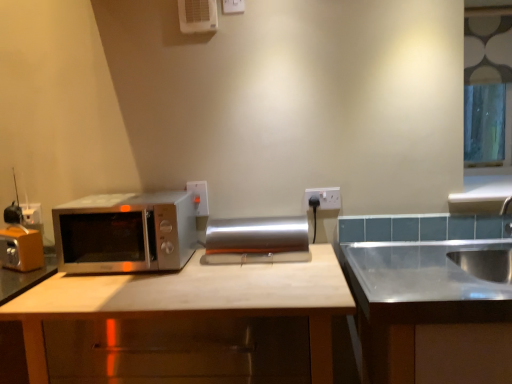
Question: Can you confirm if white plastic air conditioner at upper center is positioned to the right of matte wood cabinet at center, marked as the 1th cabinetry in a left-to-right arrangement?

Choices:
 (A) yes
 (B) no

Answer: (B)

Question: From the image's perspective, would you say white plastic air conditioner at upper center is shown under matte wood cabinet at center, which appears as the second cabinetry when viewed from the right?

Choices:
 (A) no
 (B) yes

Answer: (A)

Question: Considering the relative sizes of white plastic air conditioner at upper center and matte wood cabinet at center, which appears as the second cabinetry when viewed from the right, in the image provided, is white plastic air conditioner at upper center taller than matte wood cabinet at center, which appears as the second cabinetry when viewed from the right,?

Choices:
 (A) no
 (B) yes

Answer: (A)

Question: Can you confirm if white plastic air conditioner at upper center is bigger than matte wood cabinet at center, marked as the 1th cabinetry in a left-to-right arrangement?

Choices:
 (A) yes
 (B) no

Answer: (B)

Question: Is white plastic air conditioner at upper center to the left of matte wood cabinet at center, which appears as the second cabinetry when viewed from the right, from the viewer's perspective?

Choices:
 (A) no
 (B) yes

Answer: (B)

Question: Visually, is matte wood cabinet at center, marked as the 1th cabinetry in a left-to-right arrangement, positioned to the left or to the right of silver metallic paper towel holder at center?

Choices:
 (A) left
 (B) right

Answer: (A)

Question: Does point (31, 379) appear closer or farther from the camera than point (269, 246)?

Choices:
 (A) farther
 (B) closer

Answer: (B)

Question: From the image's perspective, is matte wood cabinet at center, marked as the 1th cabinetry in a left-to-right arrangement, positioned above or below silver metallic paper towel holder at center?

Choices:
 (A) above
 (B) below

Answer: (B)

Question: In terms of width, does matte wood cabinet at center, marked as the 1th cabinetry in a left-to-right arrangement, look wider or thinner when compared to silver metallic paper towel holder at center?

Choices:
 (A) wide
 (B) thin

Answer: (A)

Question: Is satin silver microwave at left wider or thinner than white plastic electric outlet at upper right?

Choices:
 (A) thin
 (B) wide

Answer: (B)

Question: From the image's perspective, is satin silver microwave at left located above or below white plastic electric outlet at upper right?

Choices:
 (A) above
 (B) below

Answer: (B)

Question: In terms of size, does satin silver microwave at left appear bigger or smaller than white plastic electric outlet at upper right?

Choices:
 (A) big
 (B) small

Answer: (A)

Question: From a real-world perspective, is satin silver microwave at left above or below white plastic electric outlet at upper right?

Choices:
 (A) above
 (B) below

Answer: (B)

Question: From a real-world perspective, is clear glass window at upper right positioned above or below satin silver microwave at left?

Choices:
 (A) above
 (B) below

Answer: (A)

Question: Is point (477, 52) closer or farther from the camera than point (166, 240)?

Choices:
 (A) farther
 (B) closer

Answer: (A)